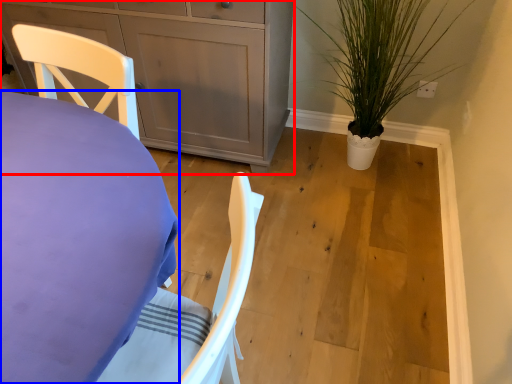
Question: Which object is closer to the camera taking this photo, cabinetry (highlighted by a red box) or desk (highlighted by a blue box)?

Choices:
 (A) cabinetry
 (B) desk

Answer: (B)